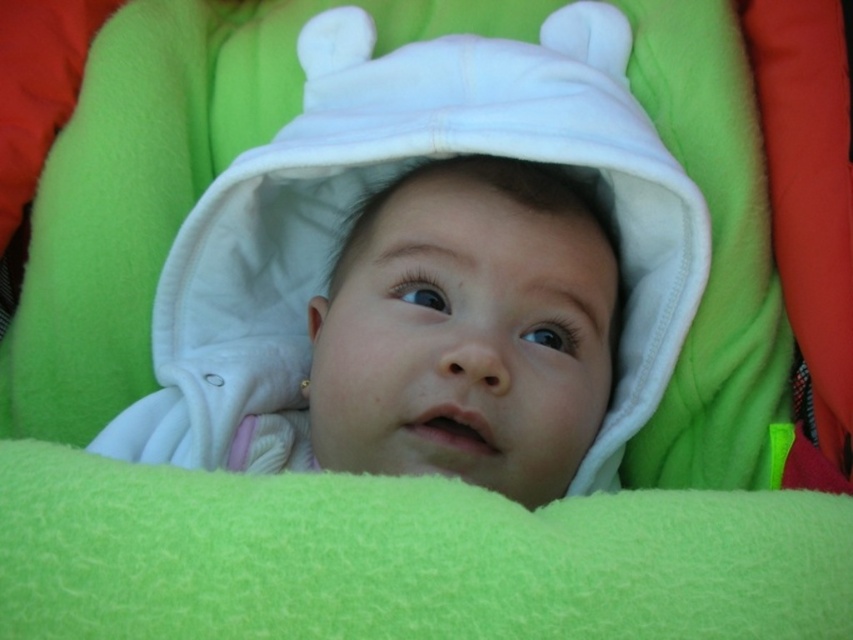
You are a photographer taking a close up of a baby. You see the green fleece blanket at center and the white fleece baby at center. Which object is positioned to the left?

The green fleece blanket at center is to the left of the white fleece baby at center.

In the scene shown: You are a photographer trying to capture the baby in the image. The baby is lying on a green fleece blanket at center. You want to place a small toy at point (403,557) to get the baby to focus on it. Will placing the toy at that point be on the blanket?

The point (403,557) is on the green fleece blanket at center, so placing the toy there will be on the blanket.

You are a caregiver trying to ensure the baby stays warm. The green fleece blanket at center and the white fleece baby at center are in close proximity. Based on the distance between them, can you confirm if the blanket is sufficiently covering the baby to maintain warmth?

The green fleece blanket at center is only 7.52 inches away from the white fleece baby at center, which means the blanket is not close enough to adequately cover the baby for warmth. Adjust the blanket to ensure it is snug against the baby.